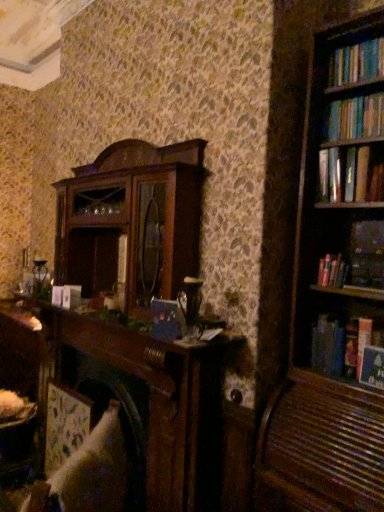
Image resolution: width=384 pixels, height=512 pixels. Describe the element at coordinates (350, 175) in the screenshot. I see `hardcover book at upper right, which appears as the fifth book when ordered from the bottom` at that location.

Locate an element on the screen. hardcover book at right, which is counted as the fourth book, starting from the top is located at coordinates (348, 350).

What do you see at coordinates (358, 258) in the screenshot? This screenshot has width=384, height=512. I see `hardcover book at right, which is counted as the second book, starting from the top` at bounding box center [358, 258].

Measure the distance between point (327, 258) and camera.

The depth of point (327, 258) is 6.07 feet.

The width and height of the screenshot is (384, 512). Find the location of `hardcover book at upper right, the fifth book in the top-to-bottom sequence`. hardcover book at upper right, the fifth book in the top-to-bottom sequence is located at coordinates (372, 367).

Where is `hardcover book at upper right, positioned as the first book in top-to-bottom order`? hardcover book at upper right, positioned as the first book in top-to-bottom order is located at coordinates (350, 175).

Can you confirm if hardcover book at right, positioned as the 3th book in bottom-to-top order, is positioned to the left of hardcover book at right, positioned as the 4th book in bottom-to-top order?

Correct, you'll find hardcover book at right, positioned as the 3th book in bottom-to-top order, to the left of hardcover book at right, positioned as the 4th book in bottom-to-top order.

Is hardcover book at right, the third book from the top, wider or thinner than hardcover book at right, positioned as the 4th book in bottom-to-top order?

Clearly, hardcover book at right, the third book from the top, has less width compared to hardcover book at right, positioned as the 4th book in bottom-to-top order.

The width and height of the screenshot is (384, 512). In order to click on book that is the 3rd one when counting leftward from the hardcover book at right, positioned as the 4th book in bottom-to-top order in this screenshot , I will do click(x=332, y=271).

How different are the orientations of hardcover book at right, the third book from the top, and hardcover book at right, which is counted as the second book, starting from the top, in degrees?

0.000907 degrees.

From the image's perspective, is hardcover book at upper right, the first book from the bottom, on top of hardcover book at upper right, positioned as the first book in top-to-bottom order?

No.

How much distance is there between hardcover book at upper right, the first book from the bottom, and hardcover book at upper right, which appears as the fifth book when ordered from the bottom?

The distance of hardcover book at upper right, the first book from the bottom, from hardcover book at upper right, which appears as the fifth book when ordered from the bottom, is 26.73 inches.

From a real-world perspective, which object stands above the other?

hardcover book at upper right, which appears as the fifth book when ordered from the bottom, from a real-world perspective.

Is hardcover book at upper right, the first book from the bottom, located outside hardcover book at upper right, which appears as the fifth book when ordered from the bottom?

Yes, hardcover book at upper right, the first book from the bottom, is not within hardcover book at upper right, which appears as the fifth book when ordered from the bottom.

Does hardcover book at right, the second book in the bottom-to-top sequence, come behind hardcover book at right, positioned as the 3th book in bottom-to-top order?

No, it is in front of hardcover book at right, positioned as the 3th book in bottom-to-top order.

Would you say hardcover book at right, which is counted as the fourth book, starting from the top, is to the left or to the right of hardcover book at right, positioned as the 3th book in bottom-to-top order, in the picture?

Based on their positions, hardcover book at right, which is counted as the fourth book, starting from the top, is located to the right of hardcover book at right, positioned as the 3th book in bottom-to-top order.

Can you tell me how much hardcover book at right, the second book in the bottom-to-top sequence, and hardcover book at right, the third book from the top, differ in facing direction?

There is a 0.00104-degree angle between the facing directions of hardcover book at right, the second book in the bottom-to-top sequence, and hardcover book at right, the third book from the top.

Can you confirm if hardcover book at right, the second book in the bottom-to-top sequence, is bigger than hardcover book at right, positioned as the 3th book in bottom-to-top order?

Correct, hardcover book at right, the second book in the bottom-to-top sequence, is larger in size than hardcover book at right, positioned as the 3th book in bottom-to-top order.

Is hardcover book at right, positioned as the 4th book in bottom-to-top order, positioned beyond the bounds of hardcover book at upper right, which appears as the fifth book when ordered from the bottom?

Yes, hardcover book at right, positioned as the 4th book in bottom-to-top order, is located beyond the bounds of hardcover book at upper right, which appears as the fifth book when ordered from the bottom.

From the image's perspective, which is above, hardcover book at right, which is counted as the second book, starting from the top, or hardcover book at upper right, positioned as the first book in top-to-bottom order?

hardcover book at upper right, positioned as the first book in top-to-bottom order.

Is hardcover book at right, positioned as the 4th book in bottom-to-top order, facing towards hardcover book at upper right, which appears as the fifth book when ordered from the bottom?

No, hardcover book at right, positioned as the 4th book in bottom-to-top order, is not oriented towards hardcover book at upper right, which appears as the fifth book when ordered from the bottom.

From a real-world perspective, which is physically above, hardcover book at right, positioned as the 4th book in bottom-to-top order, or hardcover book at upper right, positioned as the first book in top-to-bottom order?

hardcover book at upper right, positioned as the first book in top-to-bottom order.

From the image's perspective, which object appears higher, white fabric swivel chair at lower left or hardcover book at upper right, the first book from the bottom?

From the image's view, hardcover book at upper right, the first book from the bottom, is above.

Which object is wider, white fabric swivel chair at lower left or hardcover book at upper right, the first book from the bottom?

white fabric swivel chair at lower left.

Would you say white fabric swivel chair at lower left is inside or outside hardcover book at upper right, the first book from the bottom?

white fabric swivel chair at lower left is not inside hardcover book at upper right, the first book from the bottom, it's outside.

Is there a large distance between white fabric swivel chair at lower left and hardcover book at upper right, the first book from the bottom?

Yes, white fabric swivel chair at lower left and hardcover book at upper right, the first book from the bottom, are located far from each other.

Is hardcover book at right, positioned as the 4th book in bottom-to-top order, spatially inside hardcover book at right, the second book in the bottom-to-top sequence, or outside of it?

hardcover book at right, positioned as the 4th book in bottom-to-top order, is not enclosed by hardcover book at right, the second book in the bottom-to-top sequence.

Is hardcover book at right, which is counted as the second book, starting from the top, positioned with its back to hardcover book at right, the second book in the bottom-to-top sequence?

No, hardcover book at right, which is counted as the second book, starting from the top,'s orientation is not away from hardcover book at right, the second book in the bottom-to-top sequence.

From the image's perspective, between hardcover book at right, which is counted as the second book, starting from the top, and hardcover book at right, which is counted as the fourth book, starting from the top, which one is located above?

hardcover book at right, which is counted as the second book, starting from the top, is shown above in the image.

Choose the correct answer: Is hardcover book at upper right, the fifth book in the top-to-bottom sequence, inside hardcover book at right, positioned as the 4th book in bottom-to-top order, or outside it?

hardcover book at upper right, the fifth book in the top-to-bottom sequence, lies outside hardcover book at right, positioned as the 4th book in bottom-to-top order.

From a real-world perspective, count 3rd books upward from the hardcover book at upper right, the fifth book in the top-to-bottom sequence, and point to it. Please provide its 2D coordinates.

[(358, 258)]

Find the location of a particular element. This screenshot has height=512, width=384. book that is the 1st one below the hardcover book at right, positioned as the 4th book in bottom-to-top order (from a real-world perspective) is located at coordinates (332, 271).

Locate an element on the screen. Image resolution: width=384 pixels, height=512 pixels. book that is the 2nd object to the left of the hardcover book at upper right, the fifth book in the top-to-bottom sequence, starting at the anchor is located at coordinates (350, 175).

Looking at the image, which one is located closer to hardcover book at right, which is counted as the fourth book, starting from the top, white fabric swivel chair at lower left or hardcover book at right, positioned as the 4th book in bottom-to-top order?

hardcover book at right, positioned as the 4th book in bottom-to-top order, lies closer to hardcover book at right, which is counted as the fourth book, starting from the top, than the other object.

From the image, which object appears to be nearer to hardcover book at right, the third book from the top, white fabric swivel chair at lower left or hardcover book at right, which is counted as the fourth book, starting from the top?

Based on the image, hardcover book at right, which is counted as the fourth book, starting from the top, appears to be nearer to hardcover book at right, the third book from the top.

Which object lies further to the anchor point hardcover book at right, which is counted as the fourth book, starting from the top, hardcover book at upper right, positioned as the first book in top-to-bottom order, or hardcover book at right, the third book from the top?

Based on the image, hardcover book at upper right, positioned as the first book in top-to-bottom order, appears to be further to hardcover book at right, which is counted as the fourth book, starting from the top.

Estimate the real-world distances between objects in this image. Which object is closer to hardcover book at right, the second book in the bottom-to-top sequence, hardcover book at right, the third book from the top, or hardcover book at right, positioned as the 4th book in bottom-to-top order?

hardcover book at right, the third book from the top, lies closer to hardcover book at right, the second book in the bottom-to-top sequence, than the other object.

From the image, which object appears to be nearer to hardcover book at right, positioned as the 4th book in bottom-to-top order, hardcover book at right, which is counted as the fourth book, starting from the top, or white fabric swivel chair at lower left?

Among the two, hardcover book at right, which is counted as the fourth book, starting from the top, is located nearer to hardcover book at right, positioned as the 4th book in bottom-to-top order.

Looking at the image, which one is located further to hardcover book at right, which is counted as the second book, starting from the top, white fabric swivel chair at lower left or hardcover book at upper right, which appears as the fifth book when ordered from the bottom?

Among the two, white fabric swivel chair at lower left is located further to hardcover book at right, which is counted as the second book, starting from the top.

When comparing their distances from white fabric swivel chair at lower left, does hardcover book at right, positioned as the 4th book in bottom-to-top order, or hardcover book at right, which is counted as the fourth book, starting from the top, seem closer?

Among the two, hardcover book at right, which is counted as the fourth book, starting from the top, is located nearer to white fabric swivel chair at lower left.

From the image, which object appears to be nearer to white fabric swivel chair at lower left, hardcover book at upper right, the first book from the bottom, or hardcover book at right, positioned as the 3th book in bottom-to-top order?

The object closer to white fabric swivel chair at lower left is hardcover book at upper right, the first book from the bottom.

Image resolution: width=384 pixels, height=512 pixels. Identify the location of book located between white fabric swivel chair at lower left and hardcover book at right, the second book in the bottom-to-top sequence, in the left-right direction. [332, 271].

Locate an element on the screen. book that lies between hardcover book at upper right, positioned as the first book in top-to-bottom order, and hardcover book at right, positioned as the 3th book in bottom-to-top order, from top to bottom is located at coordinates pos(358,258).

At what (x,y) coordinates should I click in order to perform the action: click on book between hardcover book at right, which is counted as the second book, starting from the top, and hardcover book at right, the second book in the bottom-to-top sequence, from top to bottom. Please return your answer as a coordinate pair (x, y). The height and width of the screenshot is (512, 384). Looking at the image, I should click on [332, 271].

At what (x,y) coordinates should I click in order to perform the action: click on book that lies between hardcover book at right, positioned as the 3th book in bottom-to-top order, and hardcover book at upper right, the fifth book in the top-to-bottom sequence, from top to bottom. Please return your answer as a coordinate pair (x, y). The height and width of the screenshot is (512, 384). Looking at the image, I should click on (348, 350).